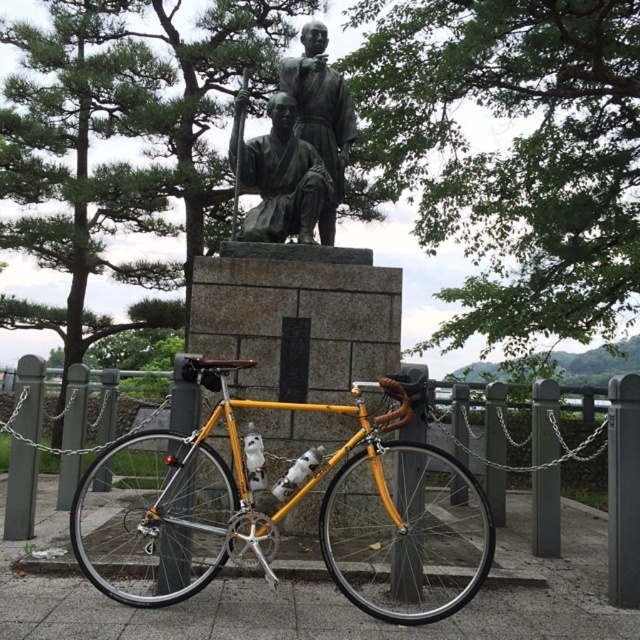
You are a painter wanting to sketch the scene. You have a canvas that can only fit objects up to the size of the bronze statue at center. Can you fit the yellow metallic bicycle at center on your canvas?

The yellow metallic bicycle at center is bigger than the bronze statue at center. Since your canvas can only accommodate objects up to the size of the bronze statue at center, the yellow metallic bicycle at center will not fit on the canvas.

You are a photographer standing in front of the bronze statue at upper center and the yellow metallic bicycle at center. You want to take a photo that captures both objects clearly. Which object should you focus on first to ensure both are in sharp focus?

You should focus on the bronze statue at upper center first because it is farther away from the viewer than the yellow metallic bicycle at center. By focusing on the farther object, the closer object will also be in focus due to the depth of field.

You are a photographer standing in front of the bronze statue at center and the bronze statue at upper center. You want to take a photo that includes both statues. Which statue should you focus on first to ensure both are in frame?

You should focus on the bronze statue at center first because it is in front of the bronze statue at upper center, so positioning the camera to include both would require starting with the closer one.